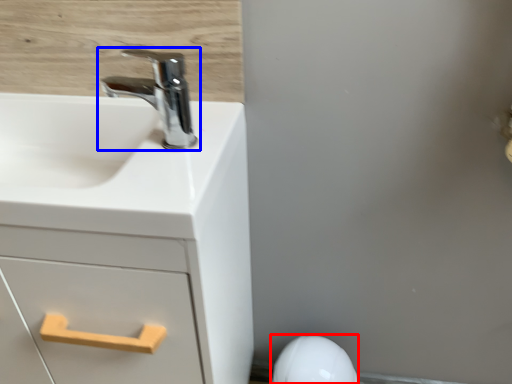
Question: Which object is further to the camera taking this photo, porcelain (highlighted by a red box) or tap (highlighted by a blue box)?

Choices:
 (A) porcelain
 (B) tap

Answer: (A)